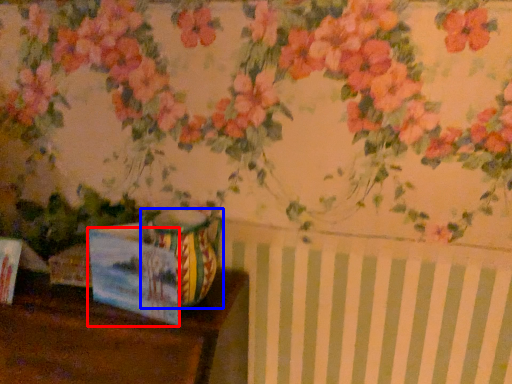
Question: Which of the following is the farthest to the observer, postcard (highlighted by a red box) or vase (highlighted by a blue box)?

Choices:
 (A) postcard
 (B) vase

Answer: (B)